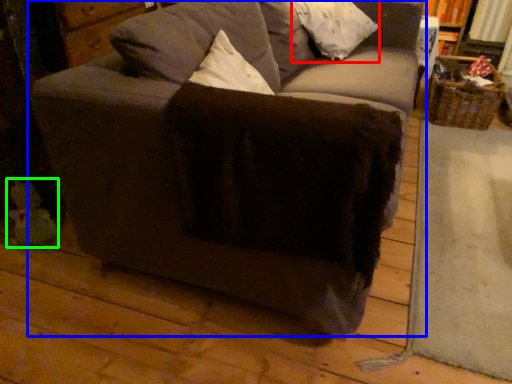
Question: Estimate the real-world distances between objects in this image. Which object is closer to pillow (highlighted by a red box), studio couch (highlighted by a blue box) or toy (highlighted by a green box)?

Choices:
 (A) studio couch
 (B) toy

Answer: (A)